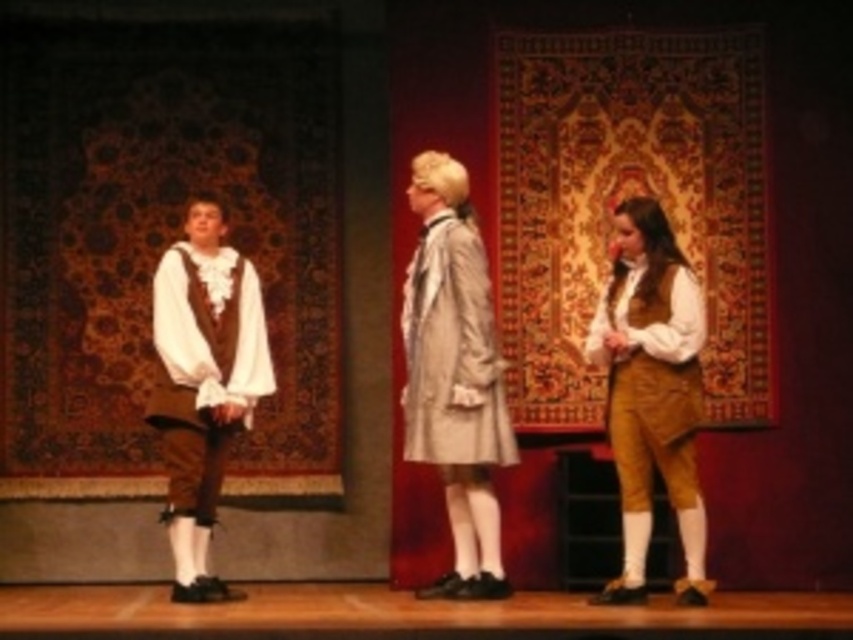
Can you confirm if matte brown vest at right is positioned to the left of matte white shirt at left?

In fact, matte brown vest at right is to the right of matte white shirt at left.

How far apart are matte brown vest at right and matte white shirt at left?

A distance of 19.86 feet exists between matte brown vest at right and matte white shirt at left.

This screenshot has height=640, width=853. What are the coordinates of `matte brown vest at right` in the screenshot? It's located at (651, 392).

Does matte brown vest at right come behind light beige fabric dress at center?

No.

Is point (610, 248) closer to viewer compared to point (454, 307)?

No, (610, 248) is behind (454, 307).

Is point (665, 333) more distant than point (463, 312)?

No, (665, 333) is in front of (463, 312).

You are a GUI agent. You are given a task and a screenshot of the screen. Output one action in this format:
    pyautogui.click(x=<x>, y=<y>)
    Task: Click on the matte brown vest at right
    
    Given the screenshot: What is the action you would take?
    pyautogui.click(x=651, y=392)

At what (x,y) coordinates should I click in order to perform the action: click on matte white shirt at left. Please return your answer as a coordinate pair (x, y). Image resolution: width=853 pixels, height=640 pixels. Looking at the image, I should click on (202, 381).

Is point (177, 554) in front of point (479, 380)?

No, (177, 554) is behind (479, 380).

I want to click on matte white shirt at left, so click(x=202, y=381).